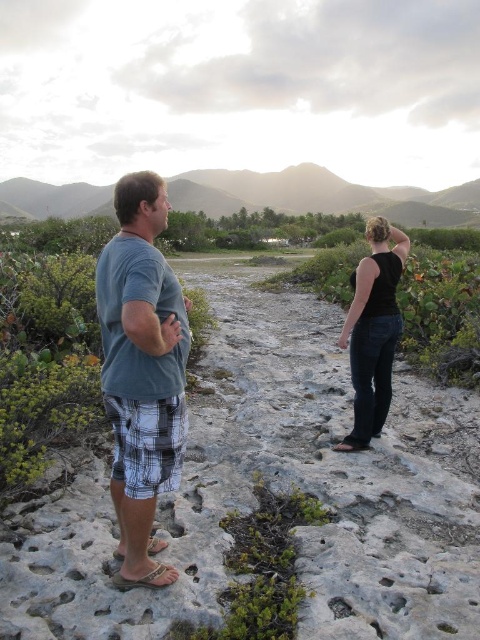
You are standing at the point labeled as point [22,524] in the image. You want to take a photo of the two people in the scene using a camera that has a maximum focus range of 3 meters. Can you capture them clearly in your photo?

The distance between point [22,524] and the camera is 3.24 meters. Since the camera can only focus up to 3 meters, you cannot capture the two people clearly because they are beyond the camera s maximum focus range.